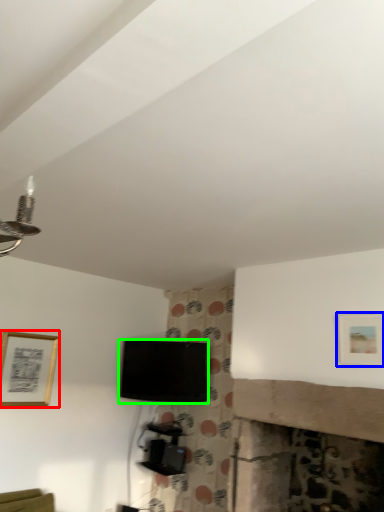
Question: Estimate the real-world distances between objects in this image. Which object is closer to picture frame (highlighted by a red box), picture frame (highlighted by a blue box) or television (highlighted by a green box)?

Choices:
 (A) picture frame
 (B) television

Answer: (B)